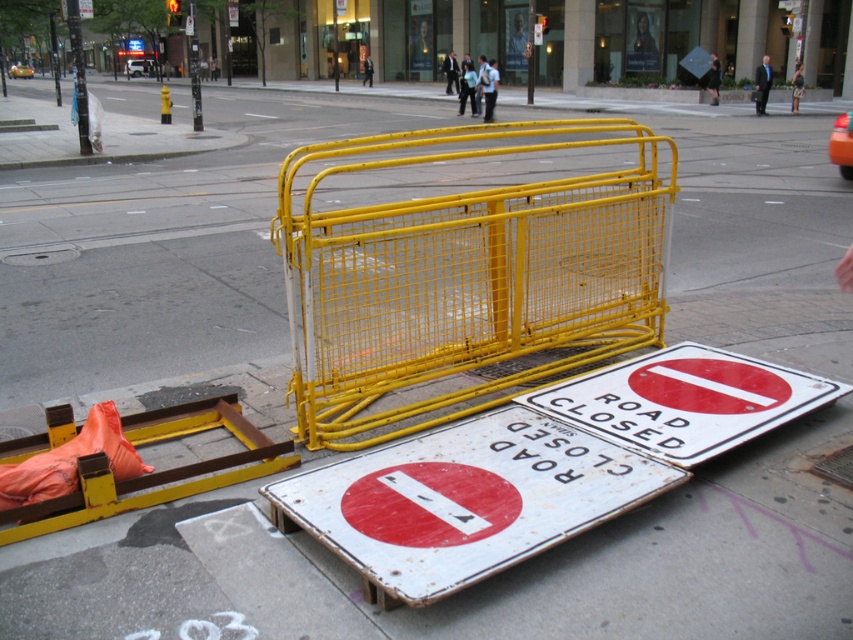
You are a delivery driver who needs to navigate around the construction area. You see the rusty metal road closed sign at center and the orange fabric barricade at lower left. Which object is located to the right of the other?

The rusty metal road closed sign at center is positioned on the right side of orange fabric barricade at lower left.

You are a delivery person trying to navigate through the city street shown. You see the yellow metal fence at center and the rusty metal road closed sign at center. Which object is higher up in the image?

The yellow metal fence at center is above the rusty metal road closed sign at center, so the yellow metal fence at center is higher up in the image.